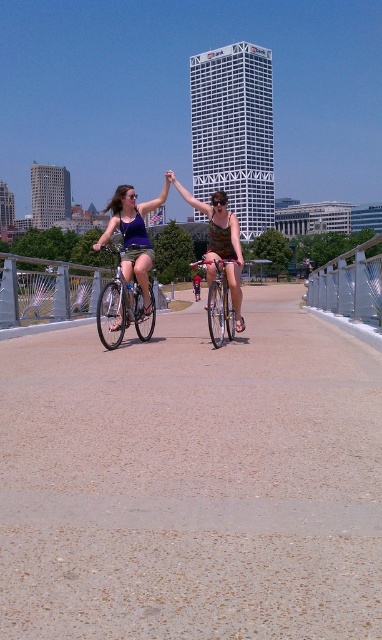
You are a delivery person who needs to place a box on the smooth concrete path at center. Can you safely place the box there without it touching the shiny silver bicycle at center?

The smooth concrete path at center has a lesser height compared to shiny silver bicycle at center, so the box can be safely placed on the smooth concrete path at center without touching the shiny silver bicycle at center.

Consider the image. You are standing on the smooth concrete path at center and want to reach the shiny silver bicycle at center. Which direction should you move to get closer to the bicycle?

Since the smooth concrete path at center is closer to the viewer than the shiny silver bicycle at center, you should move forward along the path towards the bicycle.